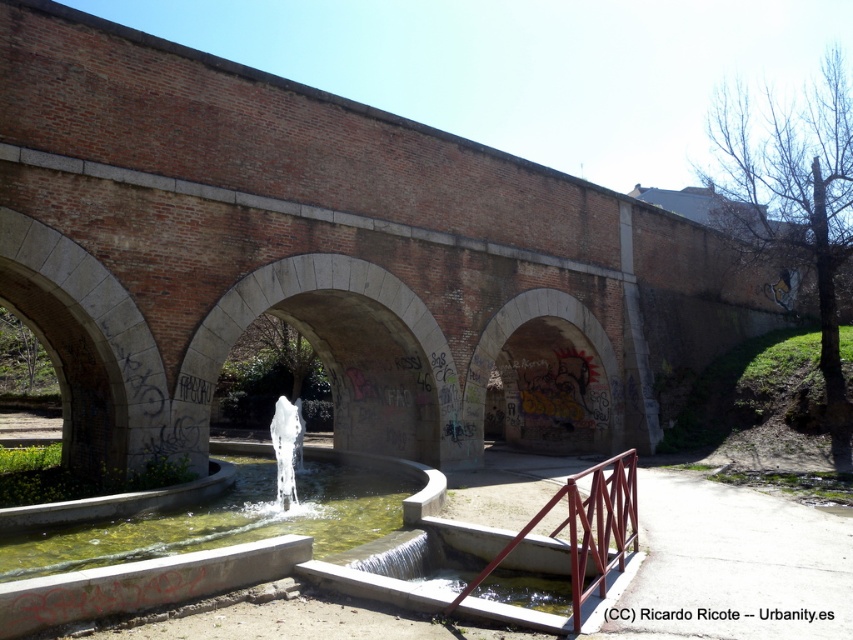
You are standing in front of the urban landscape scene. You want to walk to the metallic red railing at lower center. Since there is clear concrete water at center in the way, can you walk around it to reach the railing?

The metallic red railing at lower center is behind the clear concrete water at center, so you can walk around the clear concrete water at center to reach the metallic red railing at lower center.

You are a maintenance worker checking the urban landscape. You need to determine if the clear concrete water at center can be accessed from the ground without stepping over the metallic red railing at lower center. Can you do that?

The clear concrete water at center is shorter than the metallic red railing at lower center, so you cannot access the water without stepping over the railing because the railing is taller than the water level.